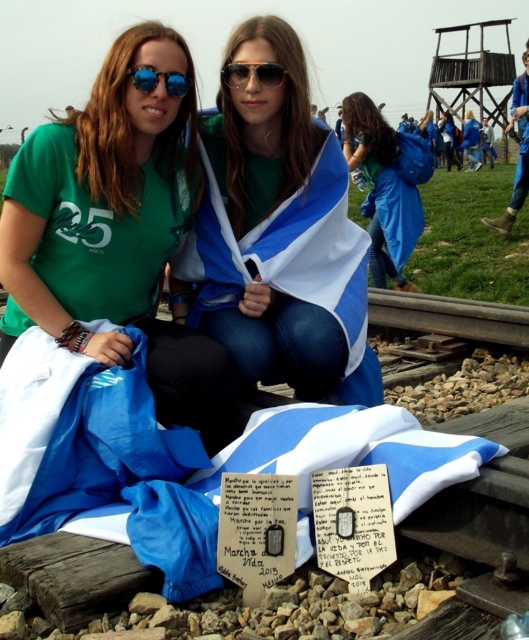
Is blue fabric flag at center taller than white paper plaque at center?

Yes.

Between point (342, 310) and point (249, 579), which one is positioned behind?

Point (342, 310)

Where is `blue fabric flag at center`? This screenshot has height=640, width=529. blue fabric flag at center is located at coordinates pos(278,234).

Is point (418, 291) farther from camera compared to point (170, 83)?

Yes, point (418, 291) is farther from viewer.

Where is `blue fabric at center`? blue fabric at center is located at coordinates (387, 186).

You are a GUI agent. You are given a task and a screenshot of the screen. Output one action in this format:
    pyautogui.click(x=<x>, y=<y>)
    Task: Click on the blue fabric at center
    This screenshot has height=640, width=529.
    Given the screenshot: What is the action you would take?
    pyautogui.click(x=387, y=186)

Who is higher up, blue fabric at center or white paper plaque at center?

Positioned higher is blue fabric at center.

Does blue fabric at center have a greater width compared to white paper plaque at center?

Indeed, blue fabric at center has a greater width compared to white paper plaque at center.

Does point (382, 253) come closer to viewer compared to point (287, 513)?

No.

I want to click on blue fabric at center, so pos(387,186).